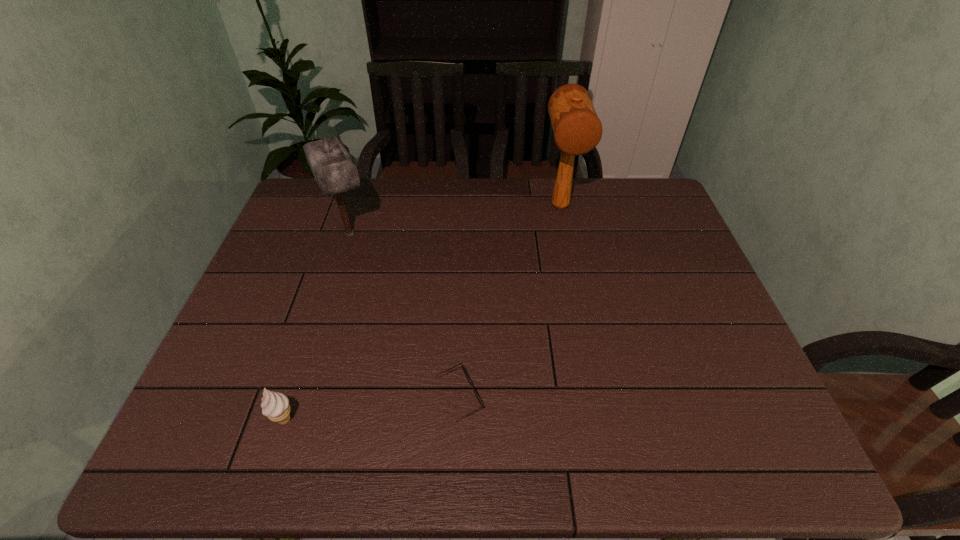
Locate which object ranks third in proximity to the right mallet. Please provide its 2D coordinates. Your answer should be formatted as a tuple, i.e. [(x, y)], where the tuple contains the x and y coordinates of a point satisfying the conditions above.

[(275, 406)]

Point out which object is positioned as the nearest to the left mallet. Please provide its 2D coordinates. Your answer should be formatted as a tuple, i.e. [(x, y)], where the tuple contains the x and y coordinates of a point satisfying the conditions above.

[(463, 369)]

Identify the location of vacant point that satisfies the following two spatial constraints: 1. on the strike surface of the rightmost object; 2. with the lenses facing outward on the spectacles. (599, 397).

This screenshot has width=960, height=540. I want to click on free space in the image that satisfies the following two spatial constraints: 1. on the strike surface of the rightmost object; 2. with the lenses facing outward on the spectacles, so click(599, 397).

Image resolution: width=960 pixels, height=540 pixels. I want to click on free location that satisfies the following two spatial constraints: 1. on the strike surface of the rightmost object; 2. on the front-facing side of the third tallest object, so click(604, 420).